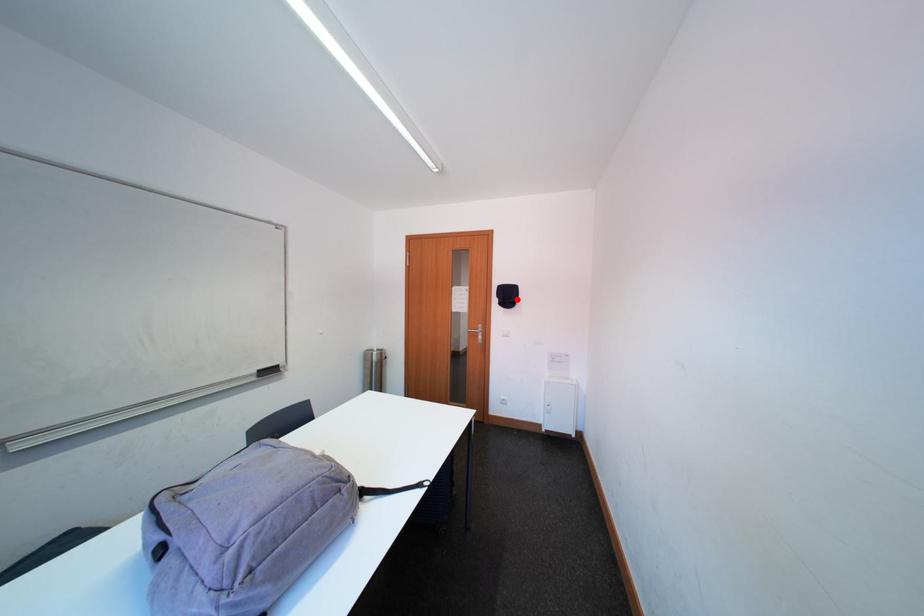
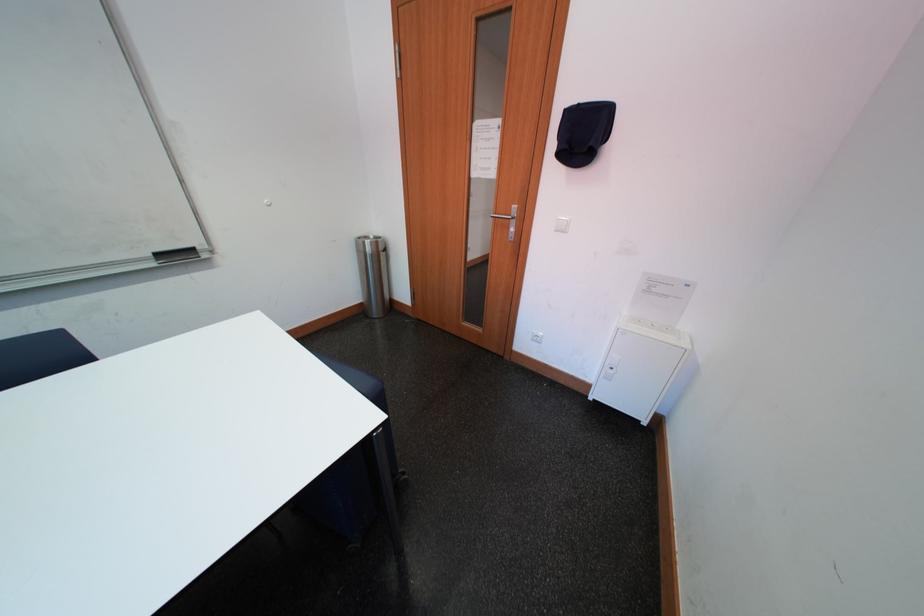
Find the pixel in the second image that matches the highlighted location in the first image.

(593, 140)